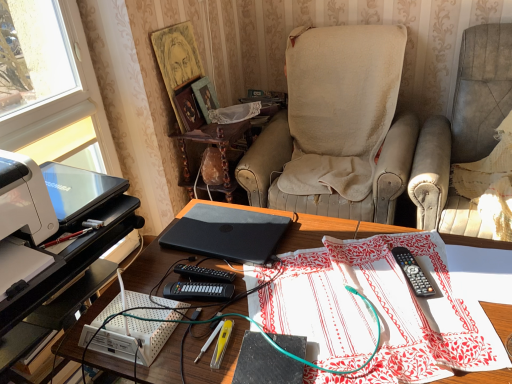
Where is `vacant area that lies in front of black plastic remote control at center, the 1th stationery from the right`? Image resolution: width=512 pixels, height=384 pixels. vacant area that lies in front of black plastic remote control at center, the 1th stationery from the right is located at coordinates (429, 326).